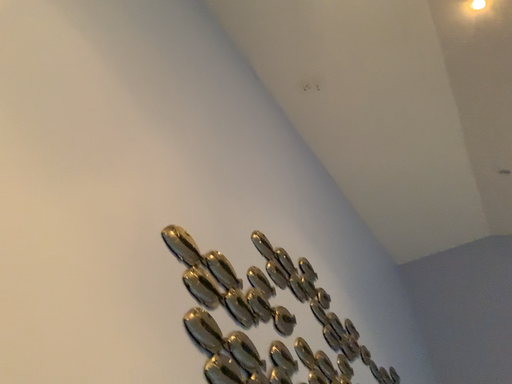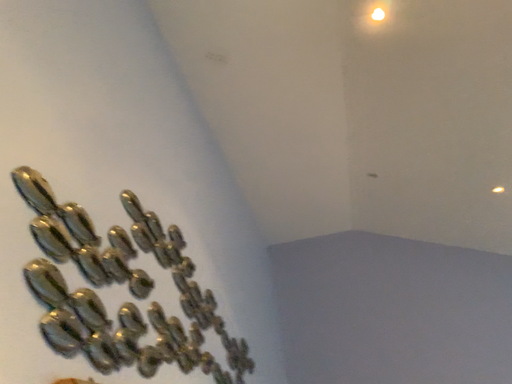
Question: How did the camera likely rotate when shooting the video?

Choices:
 (A) rotated left
 (B) rotated right

Answer: (B)